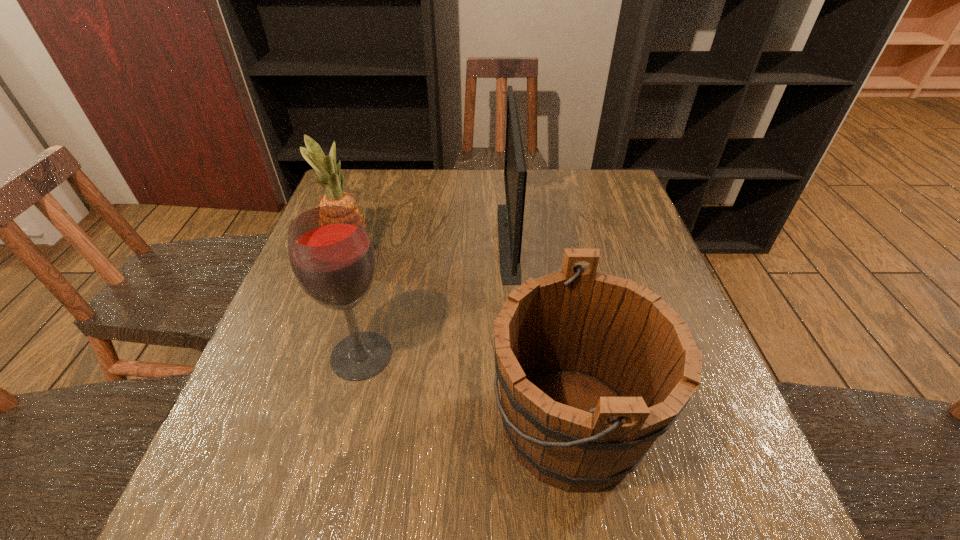
Locate an element on the screen. The width and height of the screenshot is (960, 540). blank space located 0.170m on the side of the wine bucket with the handle for carrying is located at coordinates click(397, 425).

Identify the location of vacant point located on the side of the wine bucket with the handle for carrying. The image size is (960, 540). (325, 425).

You are a GUI agent. You are given a task and a screenshot of the screen. Output one action in this format:
    pyautogui.click(x=<x>, y=<y>)
    Task: Click on the object located at the far edge
    
    Given the screenshot: What is the action you would take?
    pyautogui.click(x=510, y=217)

This screenshot has width=960, height=540. Identify the location of object located in the near edge section of the desktop. (593, 368).

Where is `alcohol situated at the left edge`? Image resolution: width=960 pixels, height=540 pixels. alcohol situated at the left edge is located at coordinates (332, 257).

Where is `pineapple that is at the left edge`? The image size is (960, 540). pineapple that is at the left edge is located at coordinates (325, 166).

Where is `object that is positioned at the right edge`? This screenshot has width=960, height=540. object that is positioned at the right edge is located at coordinates (593, 368).

Locate an element on the screen. object present at the near right corner is located at coordinates (593, 368).

At what (x,y) coordinates should I click in order to perform the action: click on vacant space at the far edge of the desktop. Please return your answer as a coordinate pair (x, y). Looking at the image, I should click on (456, 188).

Find the location of a particular element. This screenshot has width=960, height=540. free region at the near edge of the desktop is located at coordinates (393, 527).